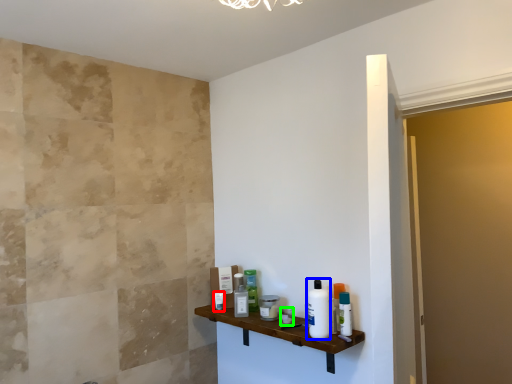
Question: Which object is positioned farthest from toiletry (highlighted by a red box)? Select from toiletry (highlighted by a blue box) and toiletry (highlighted by a green box).

Choices:
 (A) toiletry
 (B) toiletry

Answer: (A)